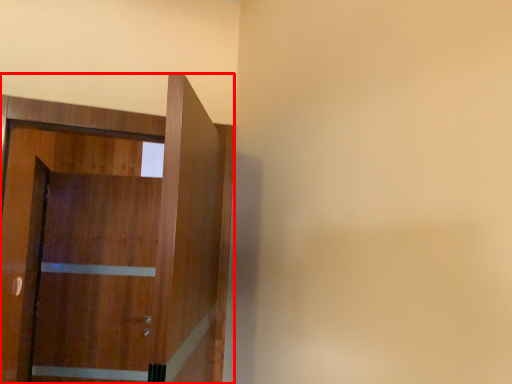
Question: From the image's perspective, considering the relative positions of door (annotated by the red box) and barn door in the image provided, where is door (annotated by the red box) located with respect to the staircase?

Choices:
 (A) above
 (B) below

Answer: (A)